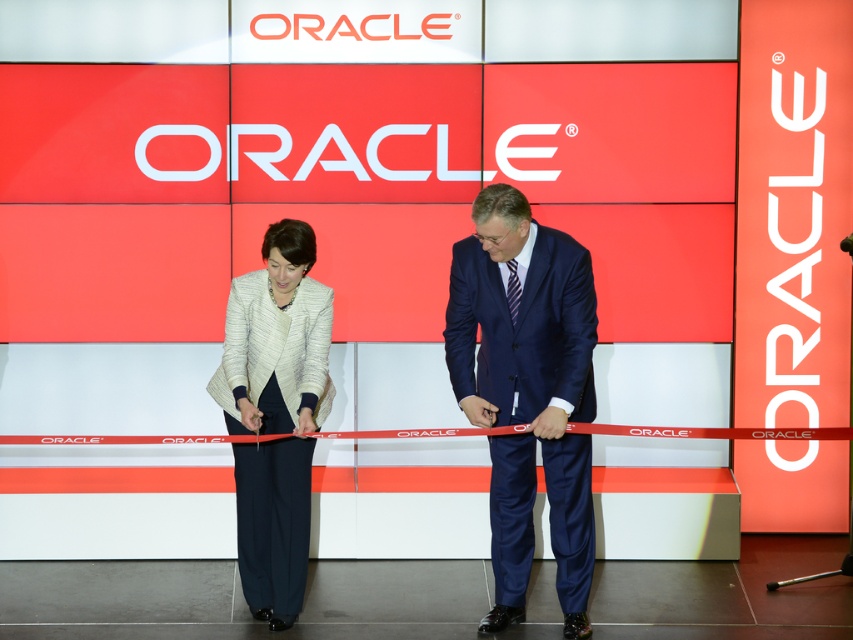
You are attending an Oracle event and notice two people in the center preparing to cut a ribbon. Which individual is positioned to the right of the other? The two people are wearing a navy blue suit at center and a white textured blazer at center.

The navy blue suit at center is positioned to the right of the white textured blazer at center.

You are a photographer standing 1.5 meters behind the camera. You need to take a photo of the person in the navy blue suit at center. Is the camera within your reach?

The distance between the navy blue suit at center and the camera is 4.20 meters. Since you are 1.5 meters behind the camera, the total distance between you and the navy blue suit at center would be 5.70 meters. Most cameras have a maximum focus range that can capture subjects at this distance, so it is likely possible to take the photo, but you may need to adjust the camera settings for clarity.

You are standing in front of the Oracle event backdrop and notice two points marked on the image. Which of these two points, point (x=585, y=356) or point (x=316, y=378), is closer to your current position?

Point (x=585, y=356) is closer to the viewer than point (x=316, y=378).